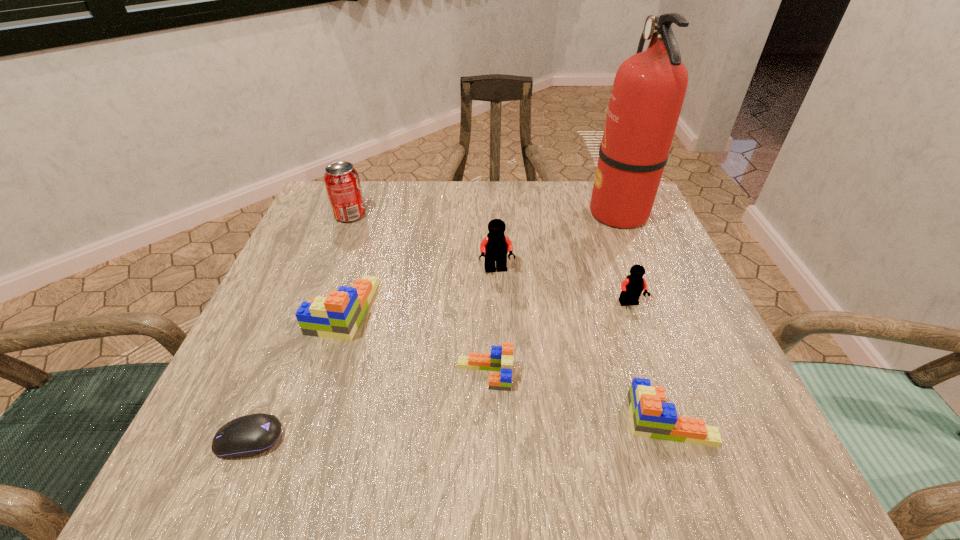
Where is `free space at the far left corner of the desktop`? The width and height of the screenshot is (960, 540). free space at the far left corner of the desktop is located at coordinates pos(363,192).

I want to click on vacant space at the far right corner of the desktop, so click(x=582, y=188).

In order to click on free space at the near right corner of the desktop in this screenshot , I will do `click(727, 463)`.

At what (x,y) coordinates should I click in order to perform the action: click on unoccupied area between the leftmost orange Lego and the tallest object. Please return your answer as a coordinate pair (x, y). The image size is (960, 540). Looking at the image, I should click on (481, 261).

In order to click on vacant region between the fire extinguisher and the second farthest orange Lego in this screenshot , I will do `click(552, 294)`.

Identify the location of empty space between the computer mouse and the soda can. This screenshot has height=540, width=960. (300, 327).

The height and width of the screenshot is (540, 960). What are the coordinates of `vacant area that lies between the nearest orange Lego and the computer mouse` in the screenshot? It's located at (459, 429).

The image size is (960, 540). What are the coordinates of `free space between the red fire extinguisher and the soda can` in the screenshot? It's located at (484, 214).

Locate an element on the screen. The image size is (960, 540). free spot between the smaller black Lego and the farthest Lego is located at coordinates tap(563, 287).

Identify the location of vacant region between the farthest orange Lego and the black computer mouse. tap(296, 374).